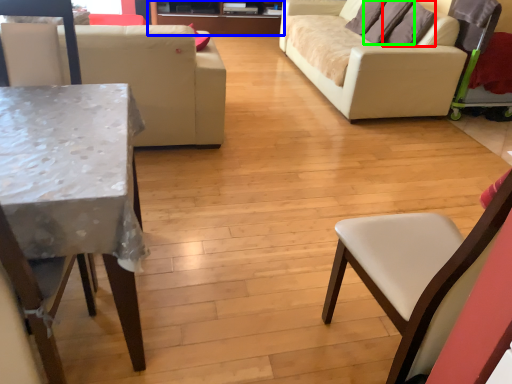
Question: Which is farther away from pillow (highlighted by a red box)? entertainment center (highlighted by a blue box) or pillow (highlighted by a green box)?

Choices:
 (A) entertainment center
 (B) pillow

Answer: (A)